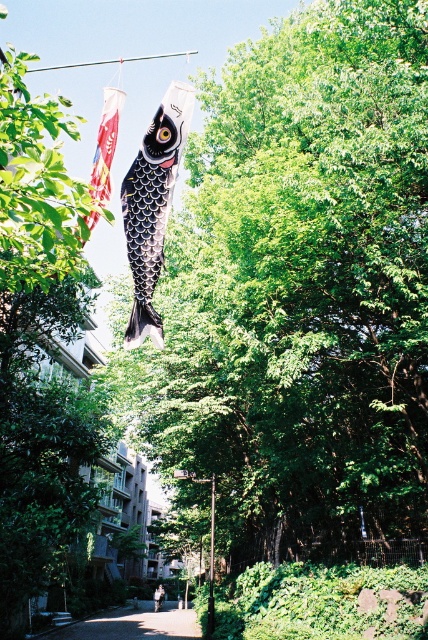
You are standing in the outdoor scene and want to take a photo of the green leafy tree at center without the fish shaped kite blocking it. Where should you move relative to the tree?

The green leafy tree at center is located at point (300,292). To avoid the kite blocking the view, move to a position where the tree is centered in your frame while ensuring the kite is out of the shot. Since the kite is in the foreground, moving slightly to the side or behind the tree might help achieve an unobstructed view.

You are a person standing on the smooth concrete path at center and want to reach the black glossy fish at center. Can you walk directly to it without any obstacles?

The distance between the black glossy fish at center and the smooth concrete path at center is 74.91 feet, so yes, you can walk directly to it since there is a clear path. However, the description does not mention any obstacles between them, so proceed with caution.

You are standing in a park and want to reach the point marked at coordinates (407, 490). The park has a path that is 1.2 meters wide. Can your 0.5 meter wide robot navigate to that point without getting stuck?

The point at coordinates (407, 490) is 13.12 meters away from the viewer. Since the path is 1.2 meters wide and the robot is only 0.5 meters wide, the robot can easily navigate to the point as its width is less than the path width.